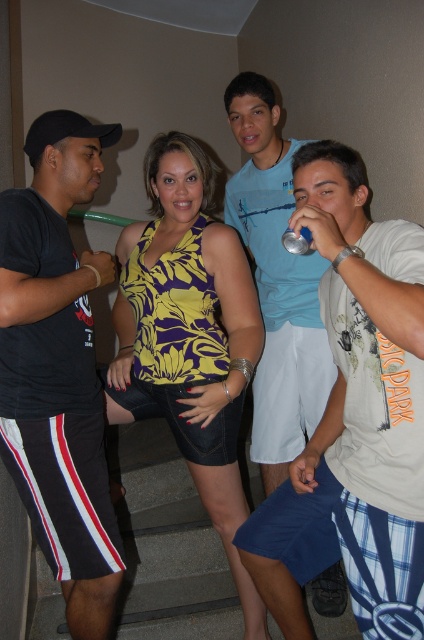
Based on the scene description, what object is located at the coordinates point (58, 368)?

The object at point (58, 368) is the black cotton t shirt at left.